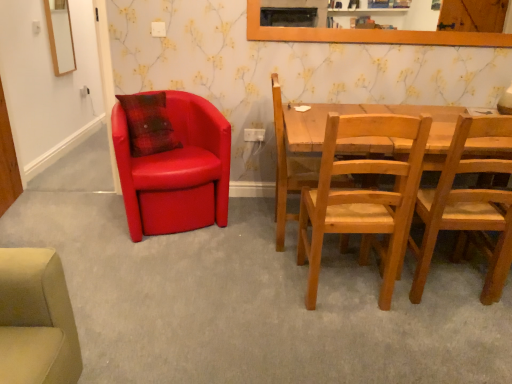
Locate an element on the screen. The height and width of the screenshot is (384, 512). free space underneath natural wood chair at center, placed as the second chair when sorted from right to left (from a real-world perspective) is located at coordinates (344, 283).